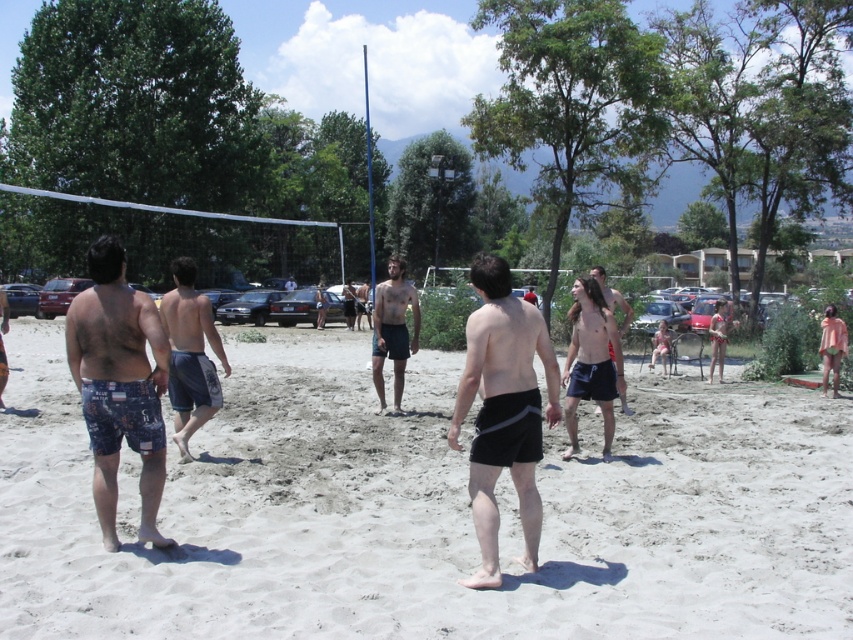
Can you confirm if black matte shorts at center is shorter than printed fabric shorts at left?

Yes, black matte shorts at center is shorter than printed fabric shorts at left.

Which is above, black matte shorts at center or printed fabric shorts at left?

printed fabric shorts at left

I want to click on black matte shorts at center, so click(x=503, y=410).

Where is `black matte shorts at center`? This screenshot has height=640, width=853. black matte shorts at center is located at coordinates (503, 410).

Can you confirm if printed swim trunks at left is wider than matte black shorts at center?

In fact, printed swim trunks at left might be narrower than matte black shorts at center.

Who is lower down, printed swim trunks at left or matte black shorts at center?

printed swim trunks at left is lower down.

This screenshot has height=640, width=853. What are the coordinates of `printed swim trunks at left` in the screenshot? It's located at (119, 385).

Which is in front, point (160, 305) or point (602, 296)?

Point (160, 305)

Who is higher up, dark blue shorts at center or shiny black shorts at center?

shiny black shorts at center

Between point (196, 413) and point (607, 298), which one is positioned behind?

Point (607, 298)

You are a GUI agent. You are given a task and a screenshot of the screen. Output one action in this format:
    pyautogui.click(x=<x>, y=<y>)
    Task: Click on the dark blue shorts at center
    The width and height of the screenshot is (853, 640).
    Given the screenshot: What is the action you would take?
    pyautogui.click(x=190, y=355)